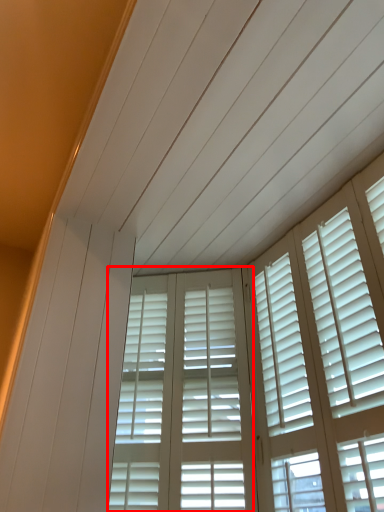
Question: From the image's perspective, where is screen door (annotated by the red box) located relative to window?

Choices:
 (A) above
 (B) below

Answer: (B)